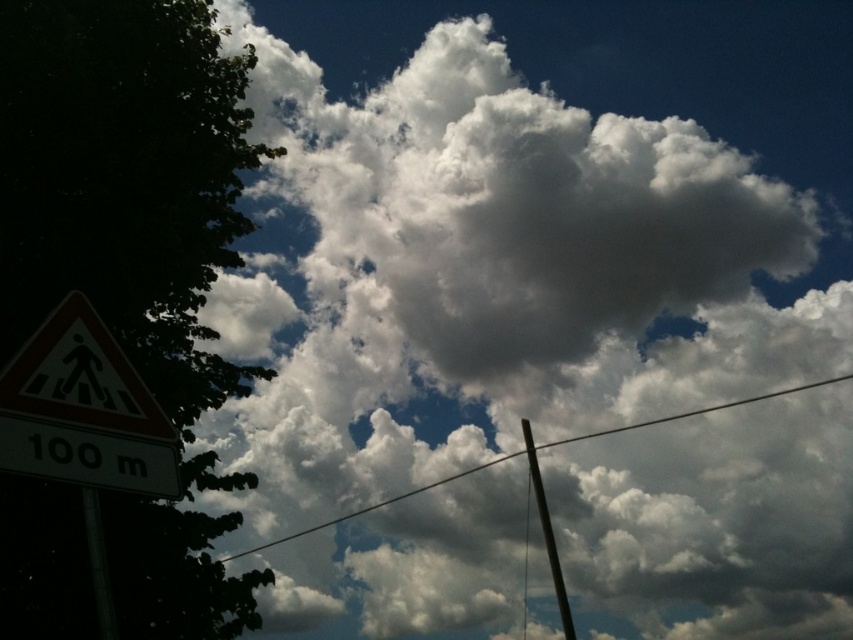
You are standing at the edge of the road and notice a green leafy tree at left and a white plastic pedestrian sign at lower left. Which object is higher up in the scene?

The green leafy tree at left is positioned over the white plastic pedestrian sign at lower left, so it is higher up in the scene.

You are a pedestrian looking at the white plastic pedestrian sign at lower left and the white wire at center. Which object is positioned higher in the image?

The white plastic pedestrian sign at lower left is positioned higher than the white wire at center.